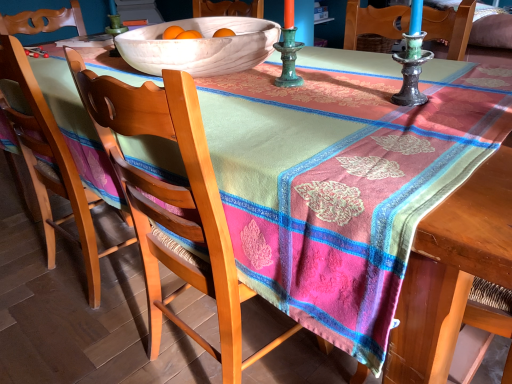
Question: Relative to wooden chair at center, acting as the 1th chair starting from the right, is wooden chair at left, positioned as the 1th chair in left-to-right order, in front or behind?

Choices:
 (A) behind
 (B) front

Answer: (A)

Question: From the image's perspective, is wooden chair at left, which ranks as the second chair in right-to-left order, above or below wooden chair at center, the 2th chair from the left?

Choices:
 (A) above
 (B) below

Answer: (A)

Question: Which object is the closest to the wooden chair at center, acting as the 1th chair starting from the right?

Choices:
 (A) white ceramic bowl at upper center
 (B) wooden chair at left, positioned as the 1th chair in left-to-right order

Answer: (A)

Question: Estimate the real-world distances between objects in this image. Which object is farther from the wooden chair at left, positioned as the 1th chair in left-to-right order?

Choices:
 (A) white ceramic bowl at upper center
 (B) wooden chair at center, acting as the 1th chair starting from the right

Answer: (A)